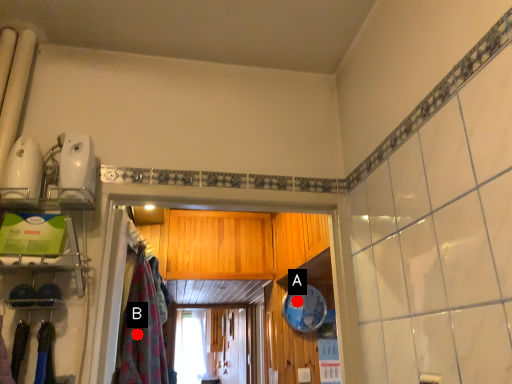
Question: Two points are circled on the image, labeled by A and B beside each circle. Which point is closer to the camera taking this photo?

Choices:
 (A) A is closer
 (B) B is closer

Answer: (B)